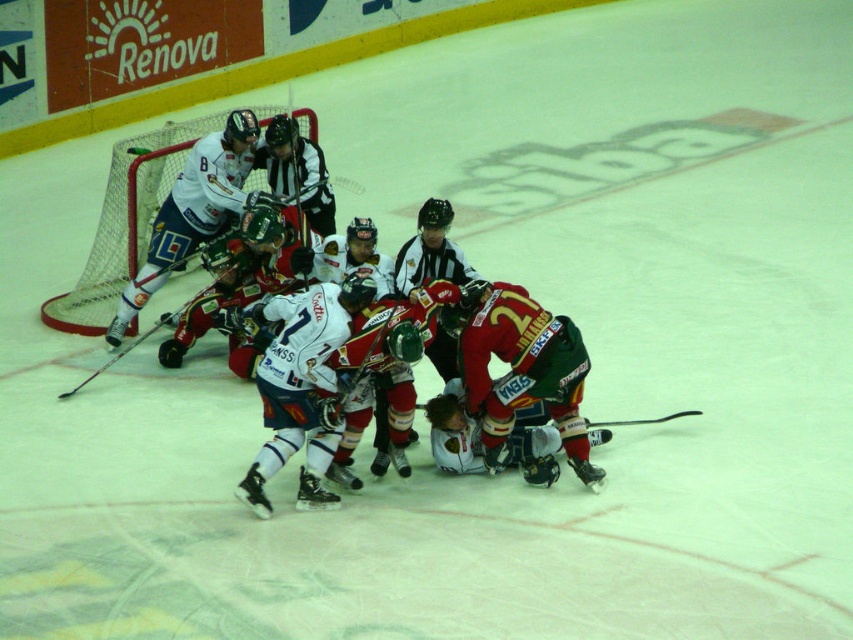
You are a referee observing the ice hockey game. You need to determine which group of players has a wider formation. Which has a wider formation between the red jersey hockey players at center and the white matte jersey at left?

The white matte jersey at left has a wider formation because the red jersey hockey players at center are narrower in width compared to the white matte jersey at left.

You are a referee standing at the edge of the ice rink. You need to check if the distance between you and the red jersey hockey players at center is within the 8 meters safety zone. Is the distance within the safety zone?

The distance between you and the red jersey hockey players at center is 7.88 meters, which is within the 8 meters safety zone.